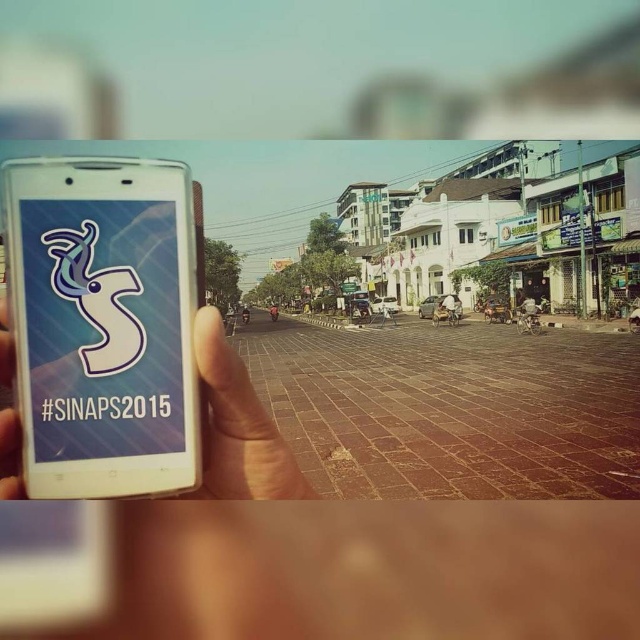
Image resolution: width=640 pixels, height=640 pixels. Describe the element at coordinates (104, 324) in the screenshot. I see `white glossy smartphone at left` at that location.

Can you confirm if white glossy smartphone at left is thinner than white matte phone at center?

Yes, white glossy smartphone at left is thinner than white matte phone at center.

What do you see at coordinates (104, 324) in the screenshot? I see `white glossy smartphone at left` at bounding box center [104, 324].

You are a GUI agent. You are given a task and a screenshot of the screen. Output one action in this format:
    pyautogui.click(x=<x>, y=<y>)
    Task: Click on the white glossy smartphone at left
    
    Given the screenshot: What is the action you would take?
    pyautogui.click(x=104, y=324)